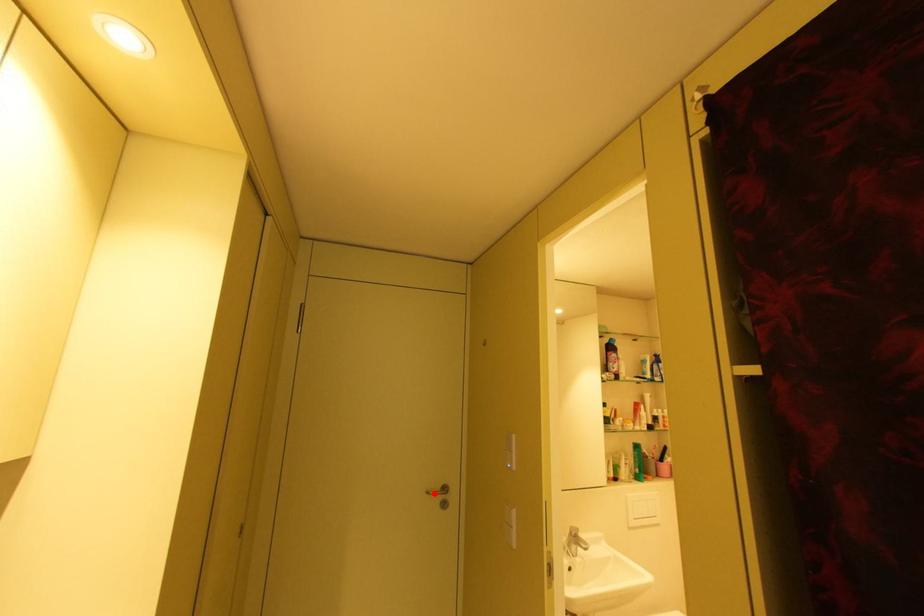
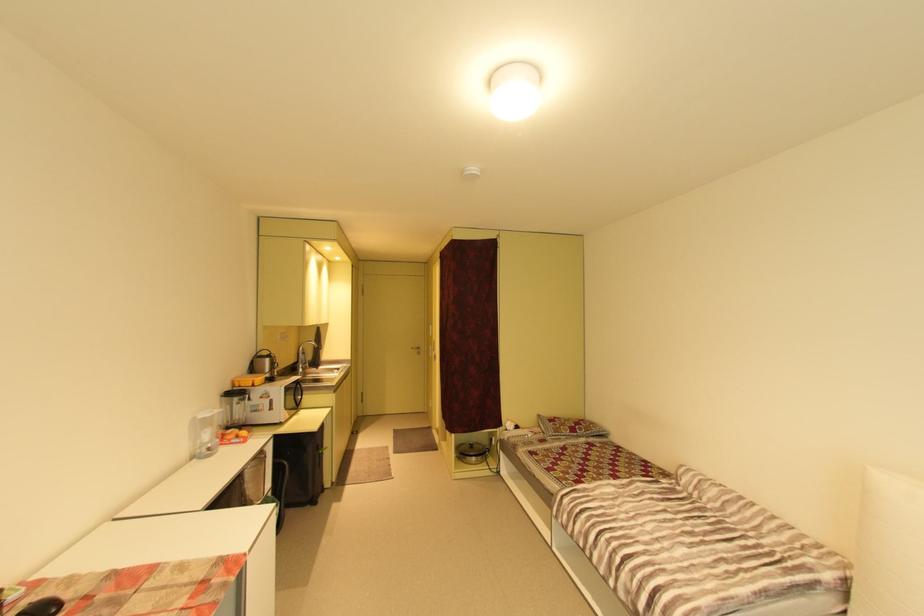
Question: I am providing you with two images of the same scene from different viewpoints. A red point is shown in image1. For the corresponding object point in image2, is it positioned nearer or farther from the camera?

Choices:
 (A) Nearer
 (B) Farther

Answer: (B)